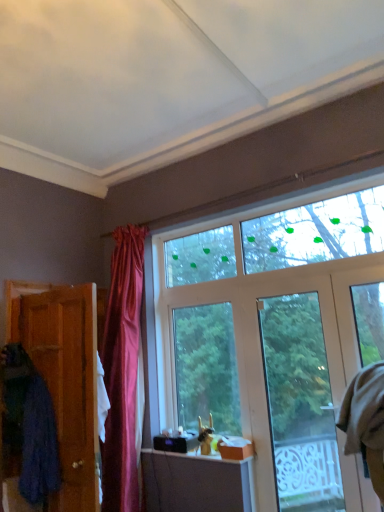
Question: From their relative heights in the image, would you say blue fabric robe at left, the 1th robe when ordered from left to right, is taller or shorter than beige fabric robe at right, which ranks as the first robe in right-to-left order?

Choices:
 (A) short
 (B) tall

Answer: (A)

Question: From the image's perspective, is blue fabric robe at left, the 1th robe when ordered from left to right, above or below beige fabric robe at right, which is the 2th robe in left-to-right order?

Choices:
 (A) below
 (B) above

Answer: (A)

Question: Based on their relative distances, which object is nearer to the blue fabric robe at left, positioned as the 2th robe in right-to-left order?

Choices:
 (A) wooden door at left
 (B) beige fabric robe at right, which ranks as the first robe in right-to-left order
 (C) clear glass door at center

Answer: (A)

Question: Estimate the real-world distances between objects in this image. Which object is closer to the clear glass door at center?

Choices:
 (A) blue fabric robe at left, positioned as the 2th robe in right-to-left order
 (B) wooden door at left
 (C) beige fabric robe at right, which is the 2th robe in left-to-right order

Answer: (C)